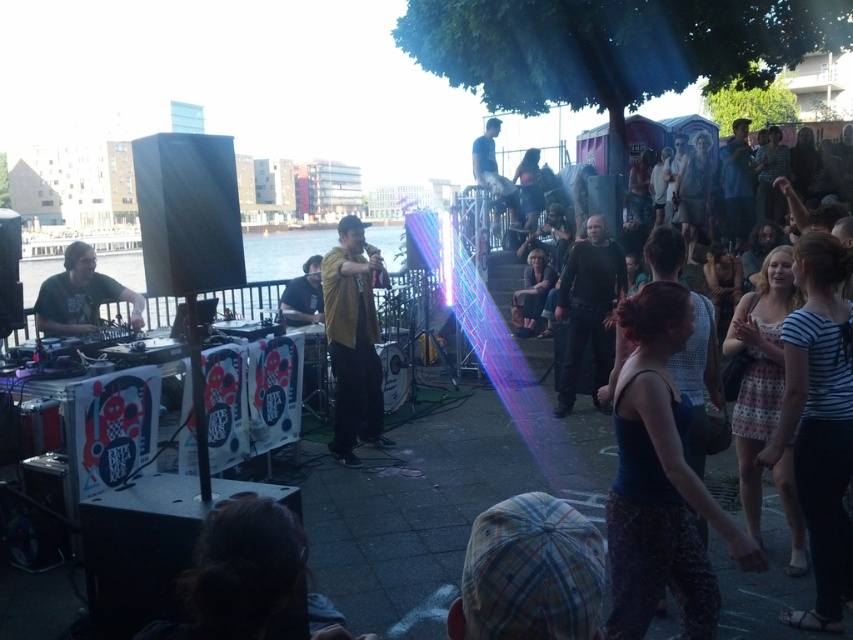
Between light brown leather jacket at center and matte yellow shirt at center, which one appears on the left side from the viewer's perspective?

matte yellow shirt at center is more to the left.

Consider the image. Is light brown leather jacket at center closer to camera compared to matte yellow shirt at center?

No.

Is point (512, 298) closer to viewer compared to point (289, 300)?

No, (512, 298) is further to viewer.

Locate an element on the screen. The width and height of the screenshot is (853, 640). light brown leather jacket at center is located at coordinates (532, 294).

Is yellow matte jacket at center thinner than dark matte leather jacket at center?

Correct, yellow matte jacket at center's width is less than dark matte leather jacket at center's.

Is yellow matte jacket at center bigger than dark matte leather jacket at center?

Indeed, yellow matte jacket at center has a larger size compared to dark matte leather jacket at center.

Between point (360, 323) and point (581, 316), which one is positioned behind?

The point (581, 316) is behind.

The width and height of the screenshot is (853, 640). I want to click on yellow matte jacket at center, so click(x=352, y=340).

Which of these two, dark matte leather jacket at center or dark blue shirt at upper center, stands shorter?

dark matte leather jacket at center is shorter.

Between dark matte leather jacket at center and dark blue shirt at upper center, which one appears on the left side from the viewer's perspective?

From the viewer's perspective, dark blue shirt at upper center appears more on the left side.

Identify the location of dark matte leather jacket at center. The height and width of the screenshot is (640, 853). (589, 308).

Find the location of a particular element. The height and width of the screenshot is (640, 853). dark matte leather jacket at center is located at coordinates (589, 308).